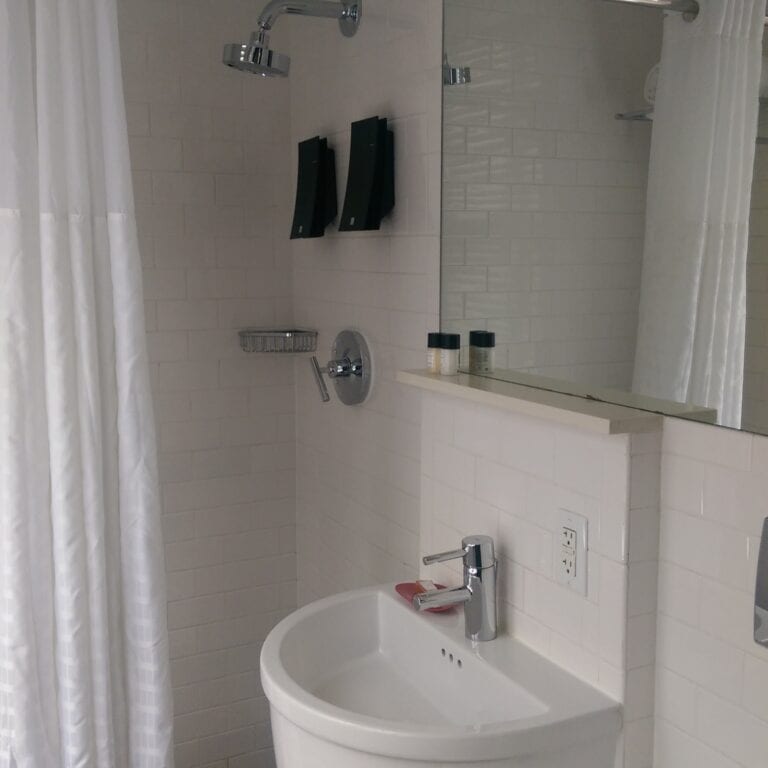
The width and height of the screenshot is (768, 768). I want to click on mirror, so click(x=603, y=329).